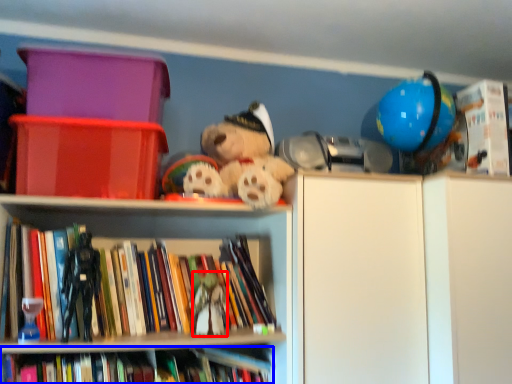
Question: Which point is further to the camera, toy (highlighted by a red box) or book (highlighted by a blue box)?

Choices:
 (A) toy
 (B) book

Answer: (A)